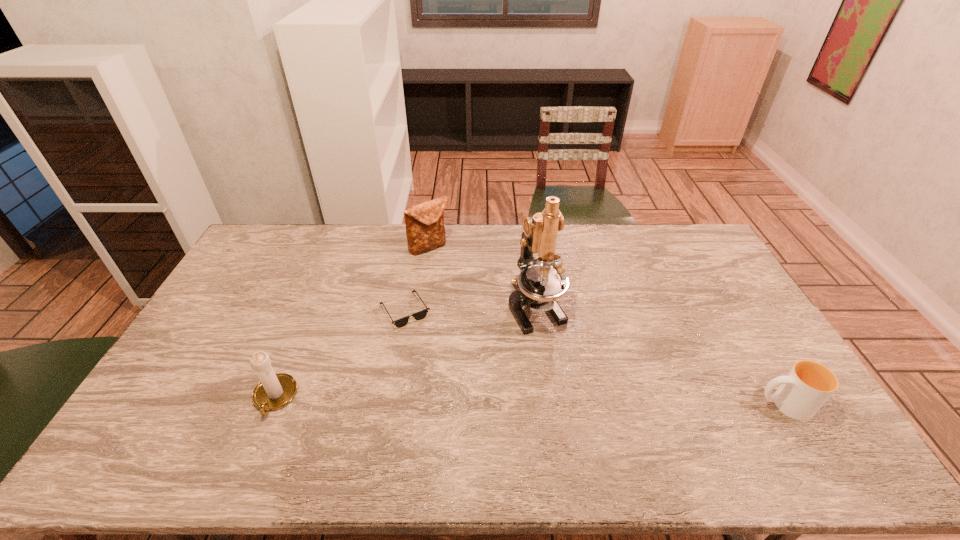
The image size is (960, 540). I want to click on free space in the image that satisfies the following two spatial constraints: 1. on the front side of the cup; 2. with the handle on the side of the shortest object, so click(388, 404).

Where is `vacant space that satisfies the following two spatial constraints: 1. on the back side of the microscope; 2. on the right side of the sunglasses`? vacant space that satisfies the following two spatial constraints: 1. on the back side of the microscope; 2. on the right side of the sunglasses is located at coordinates (405, 307).

Find the location of a particular element. The image size is (960, 540). free spot that satisfies the following two spatial constraints: 1. on the handle side of the leftmost object; 2. with the handle on the side of the fourth tallest object is located at coordinates (272, 404).

Where is `vacant position in the image that satisfies the following two spatial constraints: 1. on the front side of the shortest object; 2. with the handle on the side of the cup`? vacant position in the image that satisfies the following two spatial constraints: 1. on the front side of the shortest object; 2. with the handle on the side of the cup is located at coordinates (388, 404).

Where is `free space that satisfies the following two spatial constraints: 1. on the front side of the tallest object; 2. on the left side of the farthest object`? This screenshot has width=960, height=540. free space that satisfies the following two spatial constraints: 1. on the front side of the tallest object; 2. on the left side of the farthest object is located at coordinates (421, 307).